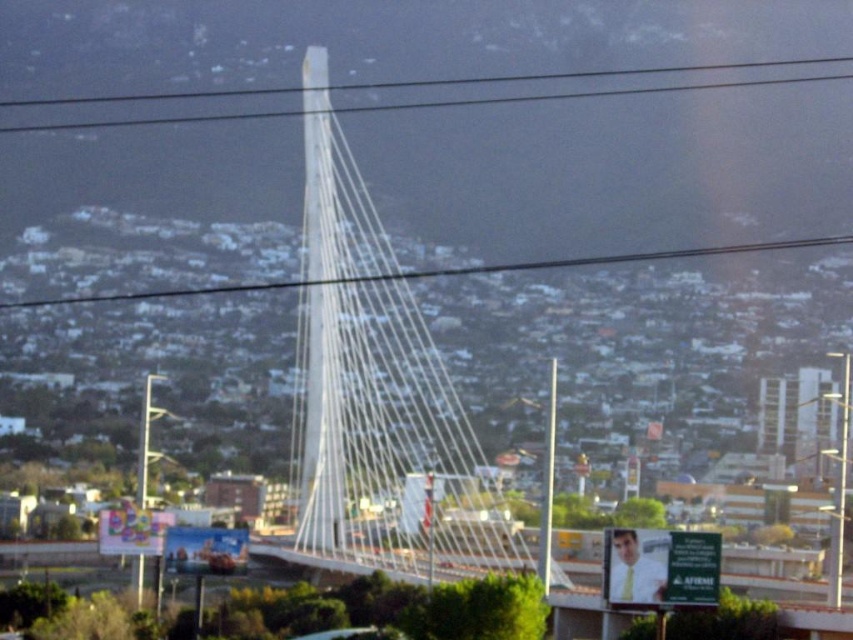
Which is in front, point (837, 241) or point (787, 81)?

Point (837, 241) is more forward.

The height and width of the screenshot is (640, 853). In order to click on white wire at center in this screenshot , I will do [x=439, y=272].

The width and height of the screenshot is (853, 640). In order to click on white wire at center in this screenshot , I will do `click(439, 272)`.

Does point (425, 512) come closer to viewer compared to point (747, 248)?

Yes, point (425, 512) is in front of point (747, 248).

Describe the element at coordinates (380, 394) in the screenshot. I see `white cable-stayed bridge at center` at that location.

Between point (309, 45) and point (445, 275), which one is positioned in front?

Point (445, 275) is in front.

You are a GUI agent. You are given a task and a screenshot of the screen. Output one action in this format:
    pyautogui.click(x=<x>, y=<y>)
    Task: Click on the white cable-stayed bridge at center
    This screenshot has height=640, width=853.
    Given the screenshot: What is the action you would take?
    [x=380, y=394]

Consider the image. Is the position of white cable-stayed bridge at center more distant than that of white glossy cable at upper center?

No, white cable-stayed bridge at center is in front of white glossy cable at upper center.

This screenshot has width=853, height=640. Identify the location of white cable-stayed bridge at center. coord(380,394).